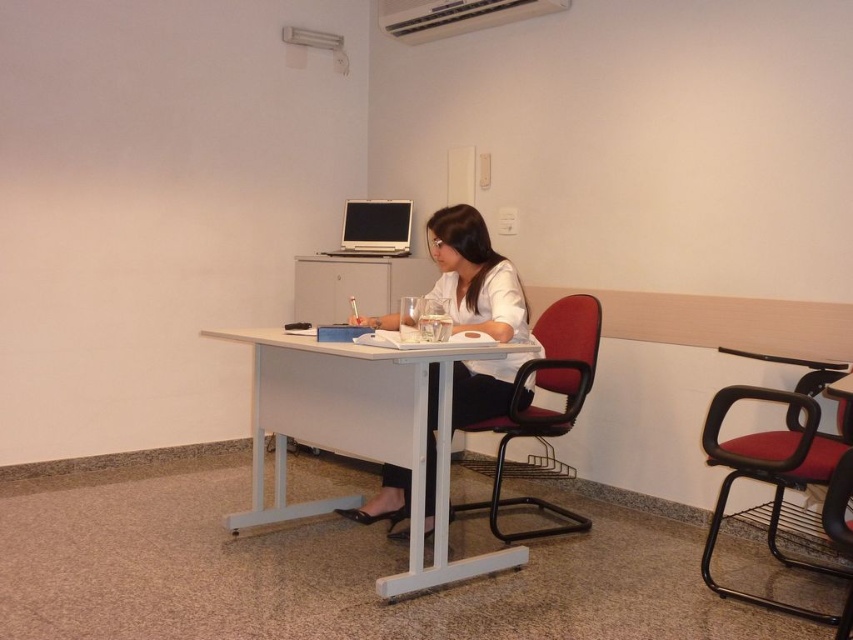
Is white plastic air conditioner at upper center positioned at the back of silver metallic laptop at center?

No, white plastic air conditioner at upper center is in front of silver metallic laptop at center.

Does point (434, 12) come farther from viewer compared to point (384, 212)?

No, it is in front of (384, 212).

This screenshot has width=853, height=640. Find the location of `white plastic air conditioner at upper center`. white plastic air conditioner at upper center is located at coordinates (456, 16).

Is point (505, 548) positioned behind point (408, 243)?

No.

Based on the photo, is white plastic table at center to the right of silver metallic laptop at center from the viewer's perspective?

Correct, you'll find white plastic table at center to the right of silver metallic laptop at center.

Is point (347, 413) positioned before point (404, 218)?

Yes, it is in front of point (404, 218).

You are a GUI agent. You are given a task and a screenshot of the screen. Output one action in this format:
    pyautogui.click(x=<x>, y=<y>)
    Task: Click on the white plastic table at center
    The width and height of the screenshot is (853, 640).
    Given the screenshot: What is the action you would take?
    pyautogui.click(x=360, y=433)

Which is behind, point (325, 442) or point (387, 22)?

Point (387, 22)

Does white plastic table at center have a larger size compared to white plastic air conditioner at upper center?

Yes.

You are a GUI agent. You are given a task and a screenshot of the screen. Output one action in this format:
    pyautogui.click(x=<x>, y=<y>)
    Task: Click on the white plastic table at center
    
    Given the screenshot: What is the action you would take?
    pyautogui.click(x=360, y=433)